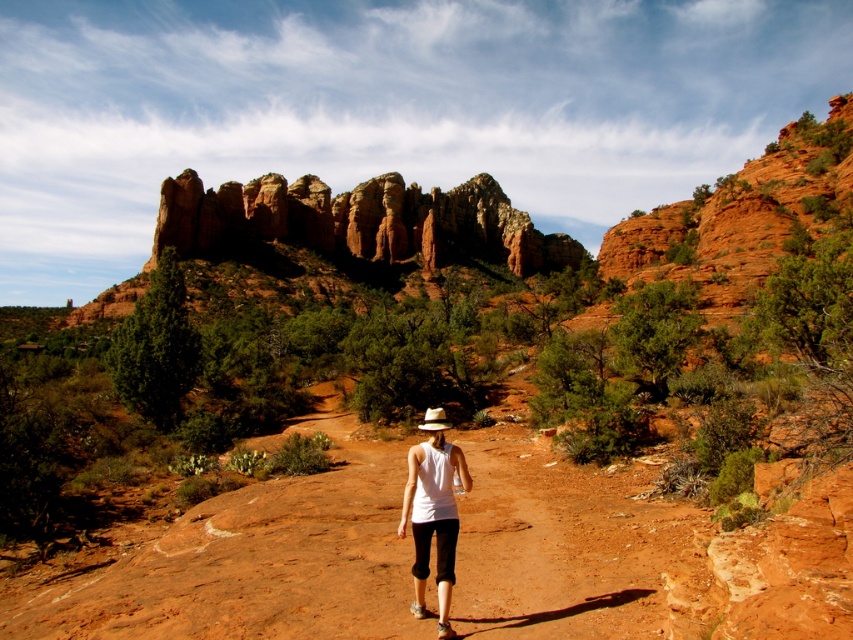
Question: Is dusty red dirt track at center below white fabric shirt at center?

Choices:
 (A) no
 (B) yes

Answer: (B)

Question: Which point is closer to the camera?

Choices:
 (A) dusty red dirt track at center
 (B) white fabric shirt at center

Answer: (A)

Question: Which point is farther to the camera?

Choices:
 (A) rustic sandstone rock formation at upper center
 (B) dusty red dirt track at center

Answer: (A)

Question: Considering the relative positions of dusty red dirt track at center and rustic sandstone rock formation at upper center in the image provided, where is dusty red dirt track at center located with respect to rustic sandstone rock formation at upper center?

Choices:
 (A) left
 (B) right

Answer: (B)

Question: Can you confirm if dusty red dirt track at center is bigger than white fabric shirt at center?

Choices:
 (A) yes
 (B) no

Answer: (A)

Question: Which point is closer to the camera taking this photo?

Choices:
 (A) (451, 572)
 (B) (314, 417)

Answer: (A)